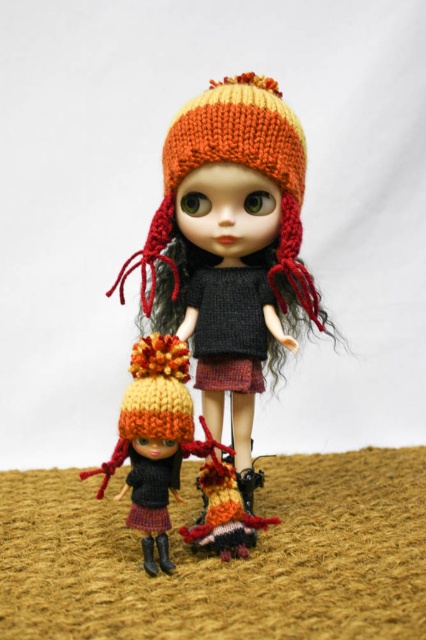
Which is behind, point (160, 336) or point (155, 513)?

The point (160, 336) is more distant.

Is point (138, 436) closer to camera compared to point (132, 477)?

Yes, point (138, 436) is in front of point (132, 477).

The image size is (426, 640). Identify the location of matte orange knit hat at lower left. (155, 440).

Can you confirm if matte orange knit hat at lower left is positioned to the left of knitted dark gray dress at center?

Indeed, matte orange knit hat at lower left is positioned on the left side of knitted dark gray dress at center.

Is matte orange knit hat at lower left wider than knitted dark gray dress at center?

Correct, the width of matte orange knit hat at lower left exceeds that of knitted dark gray dress at center.

Does point (176, 385) come behind point (206, 301)?

No, (176, 385) is in front of (206, 301).

Identify the location of matte orange knit hat at lower left. The image size is (426, 640). [155, 440].

Is point (241, 198) farther from camera compared to point (149, 419)?

Yes.

Image resolution: width=426 pixels, height=640 pixels. Find the location of `knitted woolen hat at center`. knitted woolen hat at center is located at coordinates (230, 243).